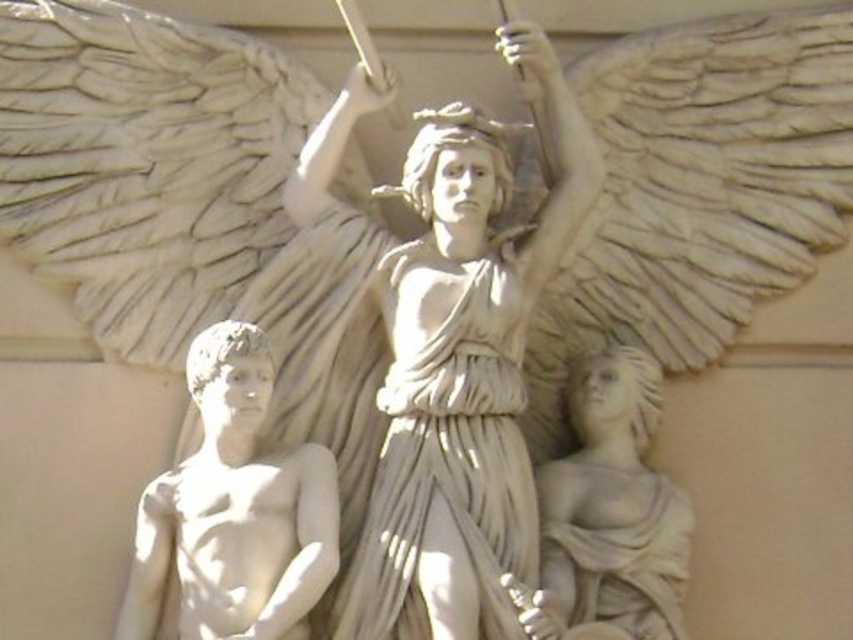
You are an art conservator examining the classical sculpture. You need to clean the white marble statue at center and the white marble statue at lower left. If you start from the front, which statue will you need to clean first without moving around the sculpture?

The white marble statue at lower left is behind the white marble statue at center, so you must clean the white marble statue at center first before reaching the one behind it.

You are an art conservator examining the sculpture. You need to clean two specific points on the sculpture. The first point is at coordinates point (402, 376) and the second is at point (663, 584). Which point is closer to the front of the sculpture?

Point (663, 584) is closer to the front of the sculpture because it is in front of point (402, 376).

You are an art conservator tasked with moving the white marble statue at lower left and the white marble statue at lower right closer together to prevent them from being damaged by environmental factors. Given that the recommended minimum distance between such statues for preservation is 10 meters, can you determine if they currently meet the safety requirement?

The distance between the white marble statue at lower left and the white marble statue at lower right is 16.95 meters, which exceeds the recommended minimum of 10 meters. Therefore, they currently meet the safety requirement and do not need to be moved closer.